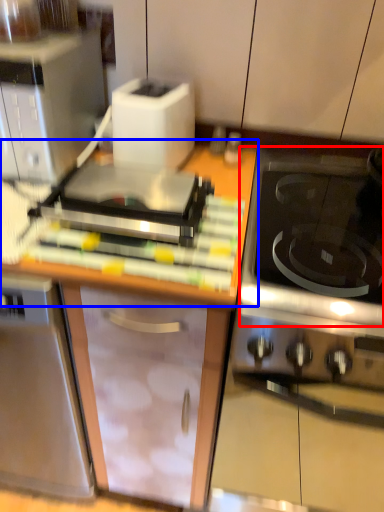
Question: Which of the following is the farthest to the observer, gas stove (highlighted by a red box) or countertop (highlighted by a blue box)?

Choices:
 (A) gas stove
 (B) countertop

Answer: (B)